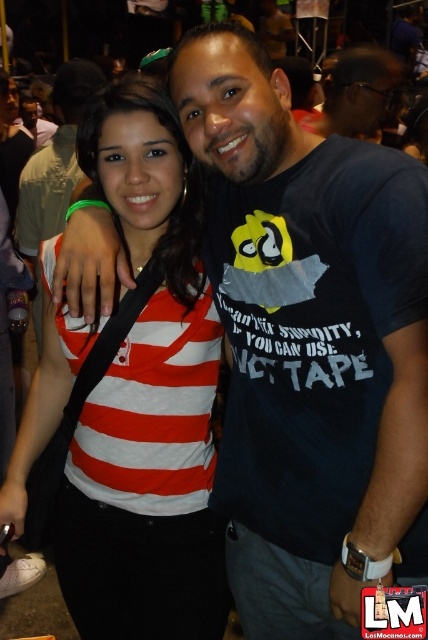
You are a photographer at the event and need to adjust your camera focus. Which of the two points, point (211, 636) or point (362, 68), should you focus on first if you want to ensure the person closest to the camera is in focus?

Point (211, 636) should be focused on first because it is in front of point (362, 68), indicating it is closer to the camera.